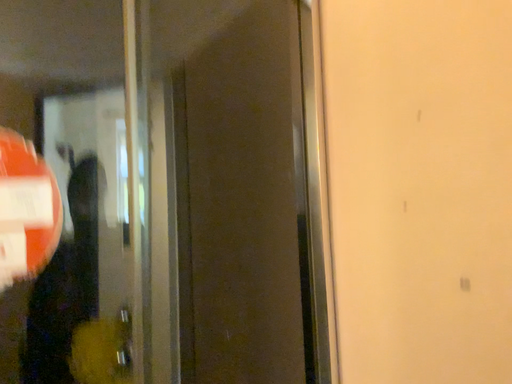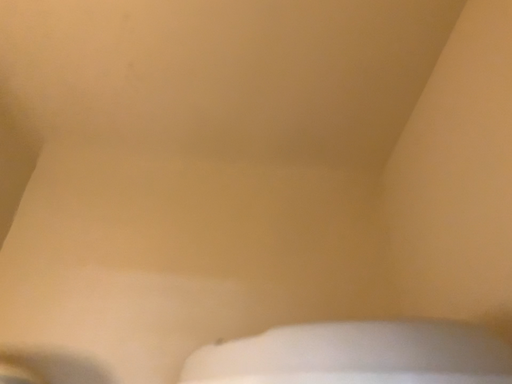
Question: How did the camera likely rotate when shooting the video?

Choices:
 (A) rotated downward
 (B) rotated upward

Answer: (B)